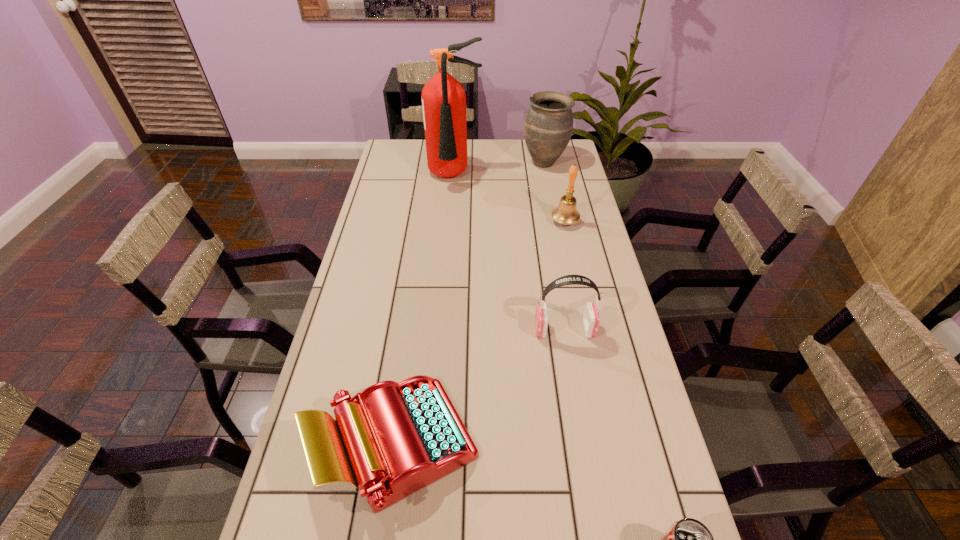
Locate an element on the screen. The width and height of the screenshot is (960, 540). free space located on the outer surface of the fourth farthest object is located at coordinates (492, 330).

Identify the location of free space located on the outer surface of the fourth farthest object. (453, 330).

I want to click on vacant space located on the outer surface of the fourth farthest object, so click(470, 330).

Where is `vacant space situated 0.390m on the typing side of the fifth tallest object`? The image size is (960, 540). vacant space situated 0.390m on the typing side of the fifth tallest object is located at coordinates (651, 444).

I want to click on fire extinguisher located at the far edge, so click(x=443, y=98).

You are a GUI agent. You are given a task and a screenshot of the screen. Output one action in this format:
    pyautogui.click(x=<x>, y=<y>)
    Task: Click on the urn that is at the far edge
    
    Given the screenshot: What is the action you would take?
    pyautogui.click(x=548, y=125)

Find the location of `object that is at the left edge`. object that is at the left edge is located at coordinates (396, 438).

Where is `urn that is at the right edge`? The width and height of the screenshot is (960, 540). urn that is at the right edge is located at coordinates tap(548, 125).

The height and width of the screenshot is (540, 960). In order to click on bell positioned at the right edge in this screenshot , I will do `click(566, 213)`.

Locate an element on the screen. earphone that is at the right edge is located at coordinates (591, 319).